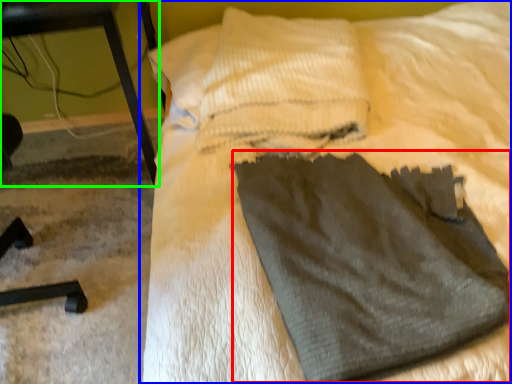
Question: Considering the real-world distances, which object is farthest from sweat pant (highlighted by a red box)? bed (highlighted by a blue box) or furniture (highlighted by a green box)?

Choices:
 (A) bed
 (B) furniture

Answer: (B)